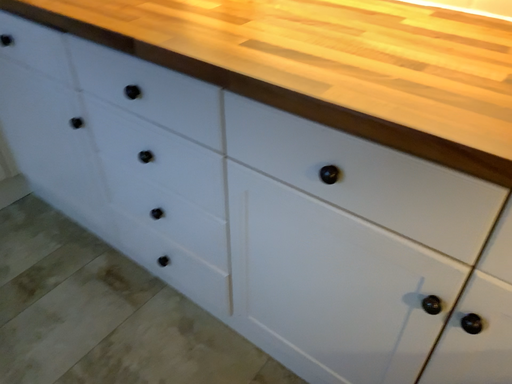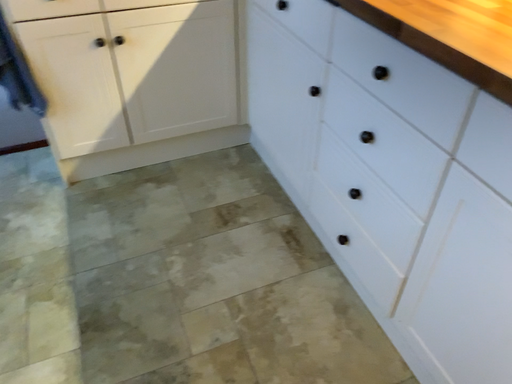
Question: Which way did the camera rotate in the video?

Choices:
 (A) rotated left
 (B) rotated right

Answer: (A)